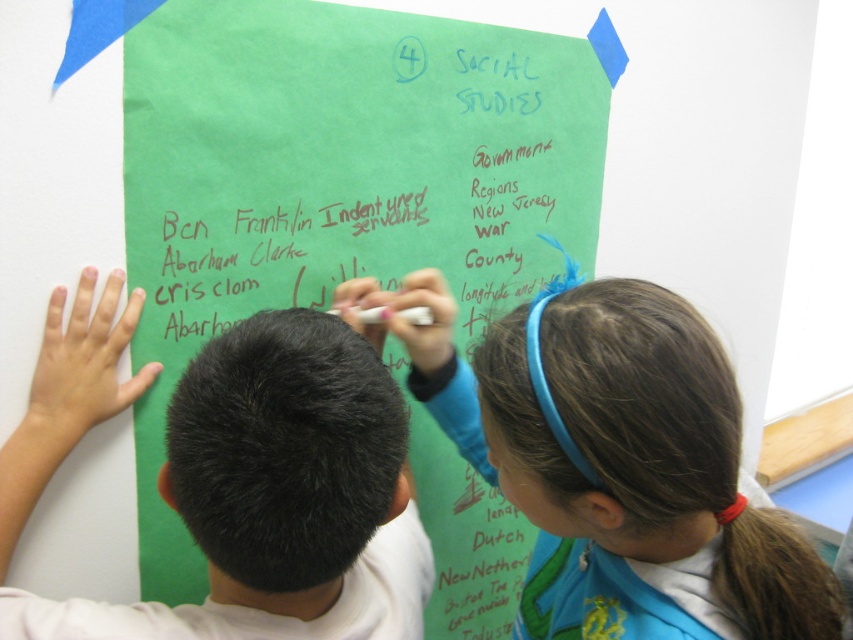
Between light brown hair at upper center and black hair at center, which one is positioned lower?

black hair at center is lower down.

Can you confirm if light brown hair at upper center is shorter than black hair at center?

No, light brown hair at upper center is not shorter than black hair at center.

What are the coordinates of `light brown hair at upper center` in the screenshot? It's located at (616, 464).

This screenshot has width=853, height=640. What are the coordinates of `light brown hair at upper center` in the screenshot? It's located at (616, 464).

What do you see at coordinates (339, 179) in the screenshot? This screenshot has height=640, width=853. I see `green paper at center` at bounding box center [339, 179].

Is green paper at center below light brown hair at upper center?

No, green paper at center is not below light brown hair at upper center.

Locate an element on the screen. green paper at center is located at coordinates (339, 179).

Locate an element on the screen. The width and height of the screenshot is (853, 640). green paper at center is located at coordinates (339, 179).

Does green paper at center appear over black hair at center?

Indeed, green paper at center is positioned over black hair at center.

Is point (310, 17) positioned behind point (387, 563)?

Yes, point (310, 17) is behind point (387, 563).

Where is `green paper at center`? The height and width of the screenshot is (640, 853). green paper at center is located at coordinates (339, 179).